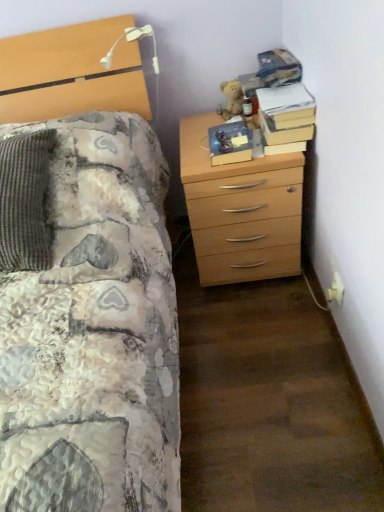
Question: Is fuzzy brown teddy bear at upper right wider than white plastic electric outlet at lower right?

Choices:
 (A) yes
 (B) no

Answer: (A)

Question: From the image's perspective, would you say fuzzy brown teddy bear at upper right is shown under white plastic electric outlet at lower right?

Choices:
 (A) yes
 (B) no

Answer: (B)

Question: From a real-world perspective, is fuzzy brown teddy bear at upper right located beneath white plastic electric outlet at lower right?

Choices:
 (A) no
 (B) yes

Answer: (A)

Question: Does fuzzy brown teddy bear at upper right have a lesser height compared to white plastic electric outlet at lower right?

Choices:
 (A) yes
 (B) no

Answer: (B)

Question: Is fuzzy brown teddy bear at upper right not inside white plastic electric outlet at lower right?

Choices:
 (A) no
 (B) yes

Answer: (B)

Question: Considering the positions of white plastic electric outlet at lower right and light wood chest of drawers at right in the image, is white plastic electric outlet at lower right wider or thinner than light wood chest of drawers at right?

Choices:
 (A) thin
 (B) wide

Answer: (A)

Question: Which is correct: white plastic electric outlet at lower right is inside light wood chest of drawers at right, or outside of it?

Choices:
 (A) outside
 (B) inside

Answer: (A)

Question: Visually, is white plastic electric outlet at lower right positioned to the left or to the right of light wood chest of drawers at right?

Choices:
 (A) right
 (B) left

Answer: (A)

Question: From the image's perspective, is white plastic electric outlet at lower right above or below light wood chest of drawers at right?

Choices:
 (A) above
 (B) below

Answer: (B)

Question: Choose the correct answer: Is light wood chest of drawers at right inside hardcover book at upper right, positioned as the 2th book in left-to-right order, or outside it?

Choices:
 (A) inside
 (B) outside

Answer: (B)

Question: In the image, is light wood chest of drawers at right positioned in front of or behind hardcover book at upper right, positioned as the 2th book in left-to-right order?

Choices:
 (A) front
 (B) behind

Answer: (A)

Question: From the image's perspective, is light wood chest of drawers at right above or below hardcover book at upper right, which appears as the first book when viewed from the right?

Choices:
 (A) above
 (B) below

Answer: (B)

Question: In terms of size, does light wood chest of drawers at right appear bigger or smaller than hardcover book at upper right, which appears as the first book when viewed from the right?

Choices:
 (A) big
 (B) small

Answer: (A)

Question: In the image, is hardcover book at center, which is the first book in left-to-right order, positioned in front of or behind hardcover book at upper right, which appears as the first book when viewed from the right?

Choices:
 (A) front
 (B) behind

Answer: (B)

Question: Looking at their shapes, would you say hardcover book at center, which is the first book in left-to-right order, is wider or thinner than hardcover book at upper right, positioned as the 2th book in left-to-right order?

Choices:
 (A) thin
 (B) wide

Answer: (A)